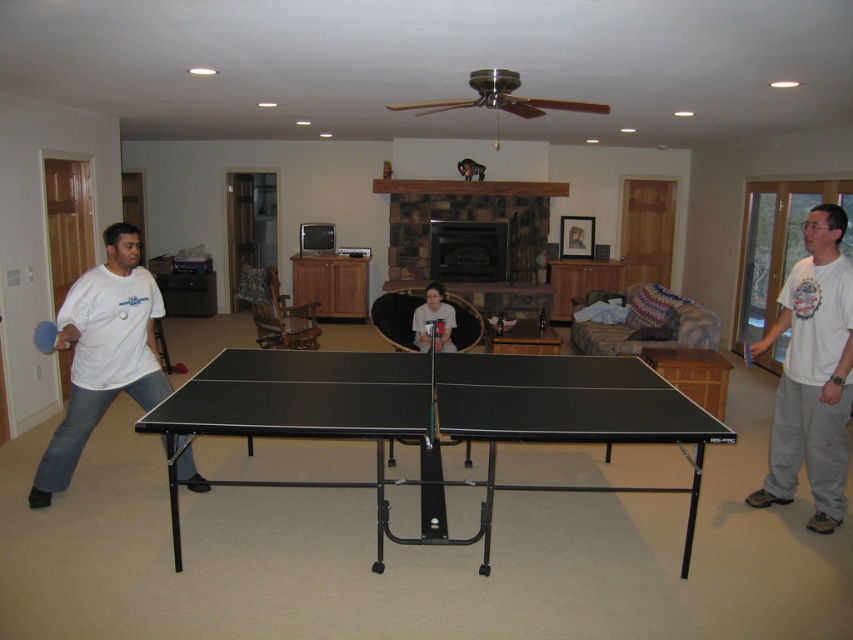
You are a new player standing at the left side of the blue foam paddle at left. You want to move to the black matte table tennis table at center. Which direction should you move to reach it?

Since the black matte table tennis table at center is to the right of the blue foam paddle at left, you should move to your right to reach it.

In the table tennis scene, there are two players wearing white cotton shirt at right and matte white shirt at center. Which player is wearing a taller shirt?

The white cotton shirt at right is taller than the matte white shirt at center.